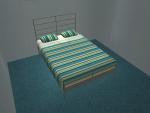
Where is `center of bed`? The image size is (150, 113). center of bed is located at coordinates (71, 55).